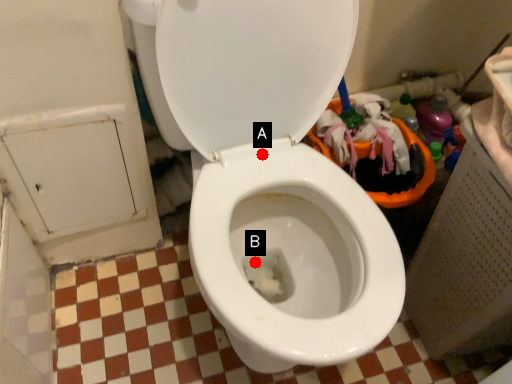
Question: Two points are circled on the image, labeled by A and B beside each circle. Which point appears closest to the camera in this image?

Choices:
 (A) A is closer
 (B) B is closer

Answer: (A)